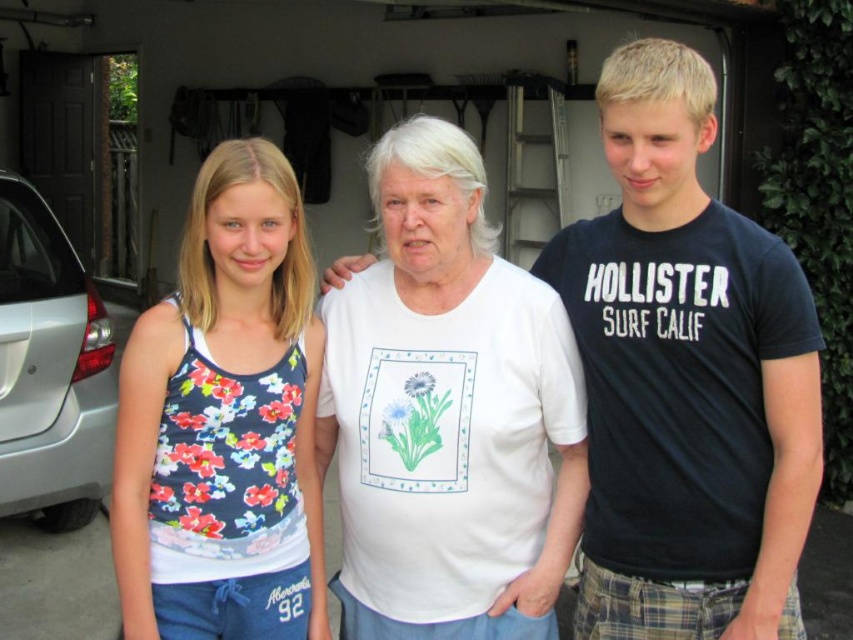
You are standing in a residential garage and see two points marked on the floor. The first point is at coordinates point (721, 259) and the second point is at point (0, 460). If you want to walk from the first point to the second point, which direction should you move relative to the garage?

To move from point (721, 259) to point (0, 460), you should move towards the lower right direction since point (721, 259) is in front of point (0, 460).